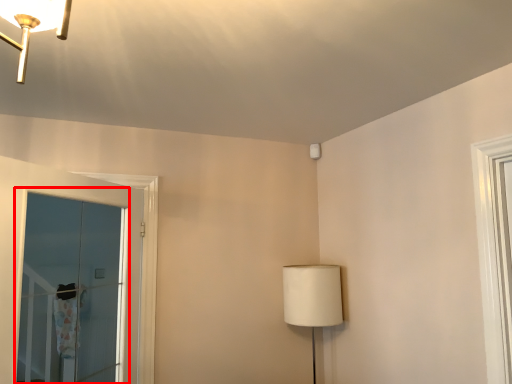
Question: Considering the relative positions of window (annotated by the red box) and table lamp in the image provided, where is window (annotated by the red box) located with respect to the staircase?

Choices:
 (A) right
 (B) left

Answer: (B)